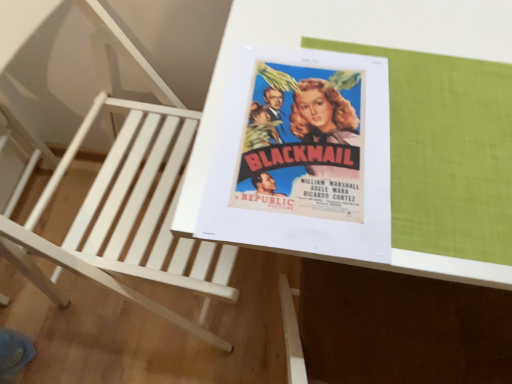
Question: From the image's perspective, is white wood chair at upper left on top of matte paper poster at center?

Choices:
 (A) no
 (B) yes

Answer: (A)

Question: Is white wood chair at upper left not within matte paper poster at center?

Choices:
 (A) no
 (B) yes

Answer: (B)

Question: Is white wood chair at upper left further to camera compared to matte paper poster at center?

Choices:
 (A) no
 (B) yes

Answer: (A)

Question: From a real-world perspective, is white wood chair at upper left located beneath matte paper poster at center?

Choices:
 (A) yes
 (B) no

Answer: (A)

Question: Can you confirm if white wood chair at upper left is taller than matte paper poster at center?

Choices:
 (A) no
 (B) yes

Answer: (B)

Question: Based on their sizes in the image, would you say white glossy table at center is bigger or smaller than matte paper poster at center?

Choices:
 (A) big
 (B) small

Answer: (A)

Question: In terms of width, does white glossy table at center look wider or thinner when compared to matte paper poster at center?

Choices:
 (A) wide
 (B) thin

Answer: (A)

Question: From a real-world perspective, is white glossy table at center above or below matte paper poster at center?

Choices:
 (A) above
 (B) below

Answer: (B)

Question: From the image's perspective, is white glossy table at center above or below matte paper poster at center?

Choices:
 (A) below
 (B) above

Answer: (A)

Question: From a real-world perspective, relative to matte paper poster at center, is white wood chair at upper left vertically above or below?

Choices:
 (A) below
 (B) above

Answer: (A)

Question: Based on their sizes in the image, would you say white wood chair at upper left is bigger or smaller than matte paper poster at center?

Choices:
 (A) small
 (B) big

Answer: (B)

Question: In terms of height, does white wood chair at upper left look taller or shorter compared to matte paper poster at center?

Choices:
 (A) tall
 (B) short

Answer: (A)

Question: Is white wood chair at upper left in front of or behind matte paper poster at center in the image?

Choices:
 (A) behind
 (B) front

Answer: (B)

Question: Choose the correct answer: Is white wood chair at upper left inside white glossy table at center or outside it?

Choices:
 (A) outside
 (B) inside

Answer: (A)

Question: Looking at the image, does white wood chair at upper left seem bigger or smaller compared to white glossy table at center?

Choices:
 (A) small
 (B) big

Answer: (B)